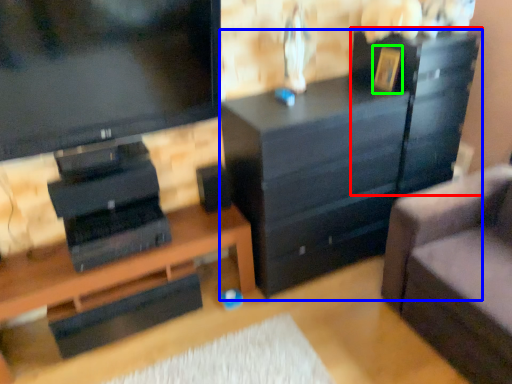
Question: Which is farther away from file cabinet (highlighted by a red box)? chest of drawers (highlighted by a blue box) or picture frame (highlighted by a green box)?

Choices:
 (A) chest of drawers
 (B) picture frame

Answer: (B)